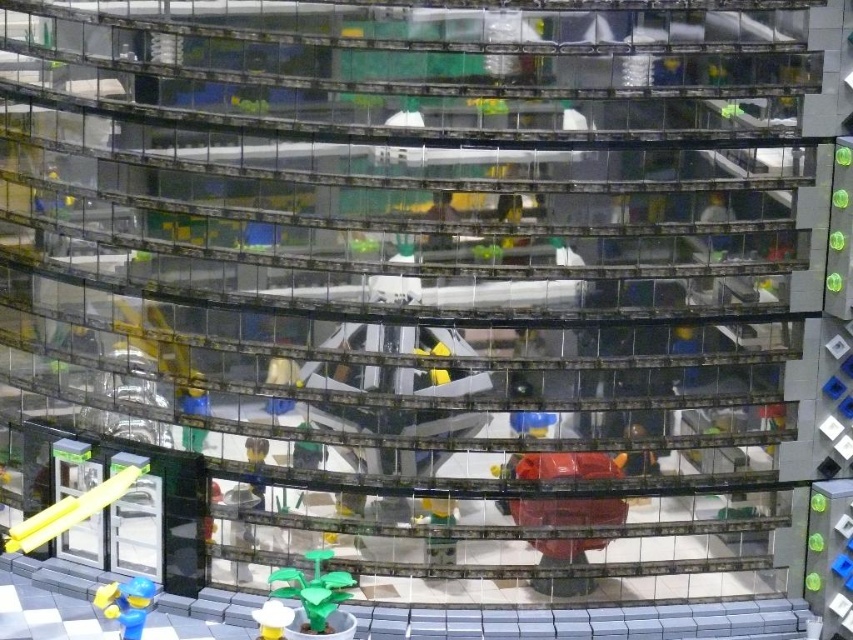
From the picture: You are a Lego figure trying to reach the white plastic cup at lower center without moving from your spot. Can the blue plastic figure at lower left see the cup if they are both inside the building?

The blue plastic figure at lower left is taller than the white plastic cup at lower center, so yes, the blue plastic figure at lower left can see the cup if they are both inside the building.